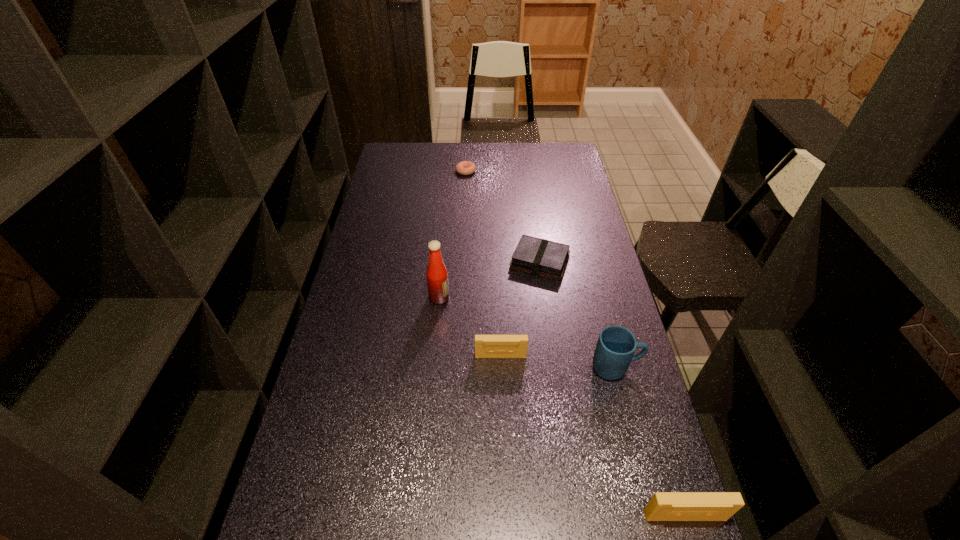
At what (x,y) coordinates should I click in order to perform the action: click on free point between the condiment and the shortest object. Please return your answer as a coordinate pair (x, y). Image resolution: width=960 pixels, height=540 pixels. Looking at the image, I should click on (453, 234).

The height and width of the screenshot is (540, 960). Identify the location of free space between the fourth nearest object and the mug. (527, 333).

Where is `free space between the condiment and the book`? Image resolution: width=960 pixels, height=540 pixels. free space between the condiment and the book is located at coordinates (490, 280).

I want to click on empty space that is in between the fifth shortest object and the left videotape, so click(558, 362).

Locate an element on the screen. Image resolution: width=960 pixels, height=540 pixels. free space between the condiment and the taller videotape is located at coordinates (562, 407).

Find the location of a particular element. blank region between the farther videotape and the taller videotape is located at coordinates (592, 436).

Where is `the third closest object to the fifth shortest object`? Image resolution: width=960 pixels, height=540 pixels. the third closest object to the fifth shortest object is located at coordinates (664, 506).

Identify the location of object that can be found as the second closest to the mug. (540, 257).